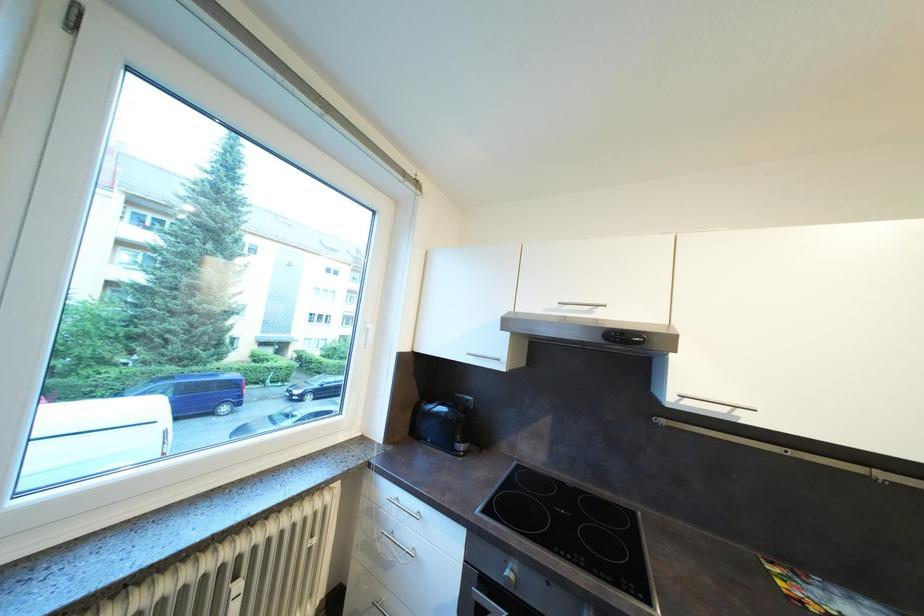
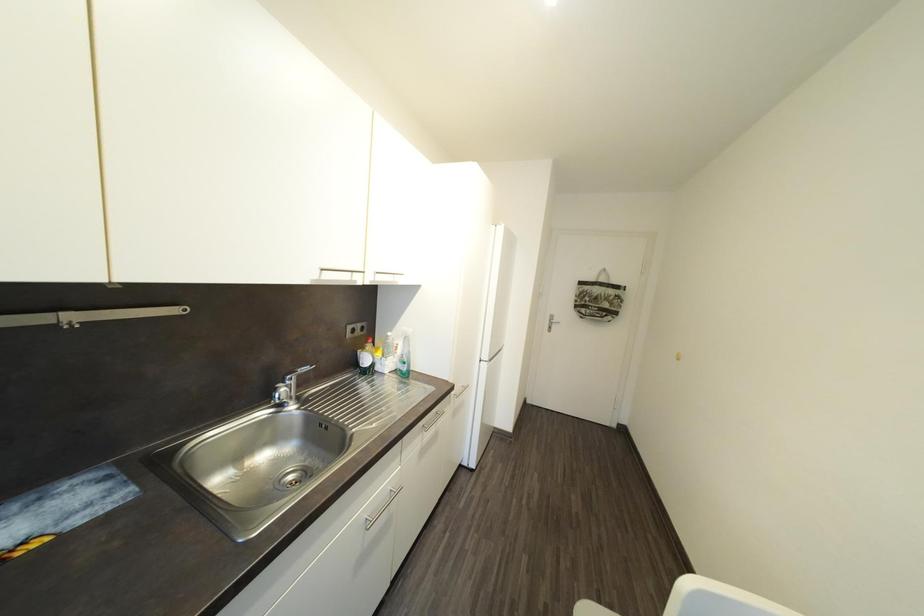
Question: The images are taken continuously from a first-person perspective. In which direction is your viewpoint rotating?

Choices:
 (A) Left
 (B) Right
 (C) Up
 (D) Down

Answer: (B)